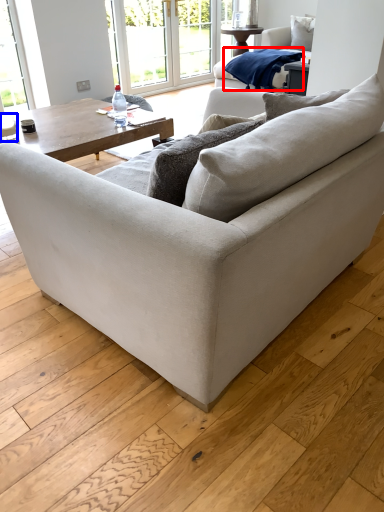
Question: Among these objects, which one is nearest to the camera, material (highlighted by a red box) or coffee cup (highlighted by a blue box)?

Choices:
 (A) material
 (B) coffee cup

Answer: (B)